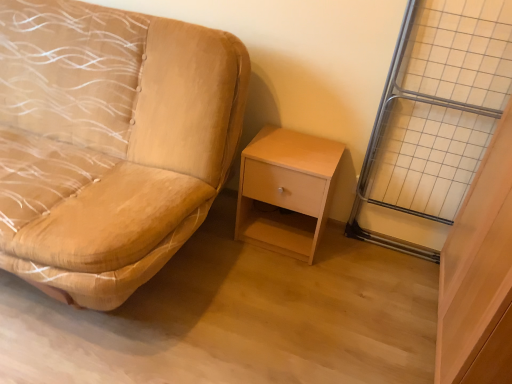
Question: Considering the relative positions of light wood/finely finished nightstand at center-right and suede-like beige studio couch at left in the image provided, is light wood/finely finished nightstand at center-right to the left or to the right of suede-like beige studio couch at left?

Choices:
 (A) left
 (B) right

Answer: (B)

Question: Considering the positions of point (257, 162) and point (86, 288), is point (257, 162) closer or farther from the camera than point (86, 288)?

Choices:
 (A) closer
 (B) farther

Answer: (B)

Question: Which of these objects is positioned farthest from the light wood/finely finished nightstand at center-right?

Choices:
 (A) suede-like beige studio couch at left
 (B) metal grid at right

Answer: (A)

Question: Which object is the farthest from the suede-like beige studio couch at left?

Choices:
 (A) light wood/finely finished nightstand at center-right
 (B) metal grid at right

Answer: (B)